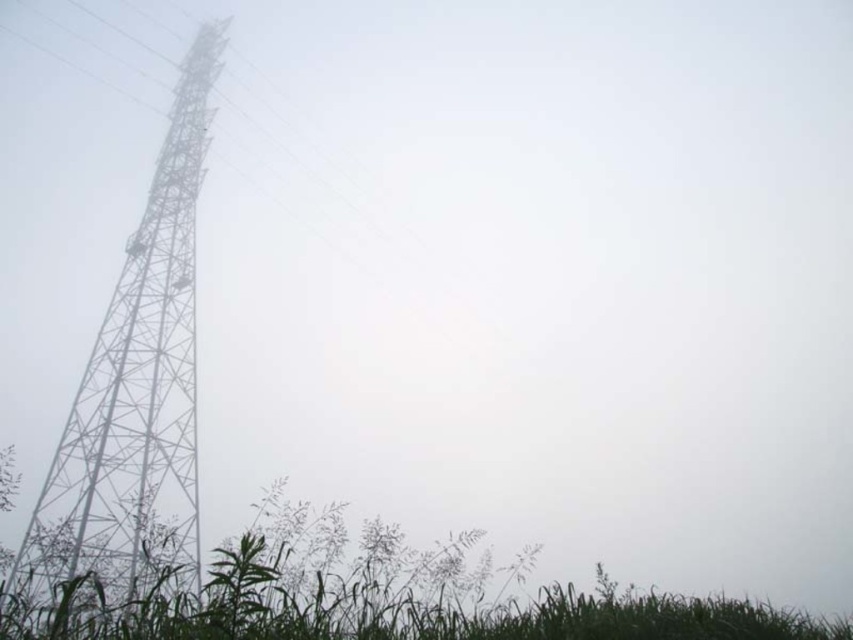
Question: Does metallic tower at left have a greater width compared to green grass at lower left?

Choices:
 (A) yes
 (B) no

Answer: (A)

Question: Which of the following is the closest to the observer?

Choices:
 (A) green grassy at lower left
 (B) metallic tower at left

Answer: (A)

Question: Can you confirm if metallic tower at left is wider than green grassy at lower left?

Choices:
 (A) no
 (B) yes

Answer: (A)

Question: Which point is farther to the camera?

Choices:
 (A) green grass at lower left
 (B) metallic tower at left

Answer: (B)

Question: Can you confirm if green grassy at lower left is positioned to the left of green grass at lower left?

Choices:
 (A) no
 (B) yes

Answer: (A)

Question: Estimate the real-world distances between objects in this image. Which object is closer to the green grass at lower left?

Choices:
 (A) green grassy at lower left
 (B) metallic tower at left

Answer: (A)